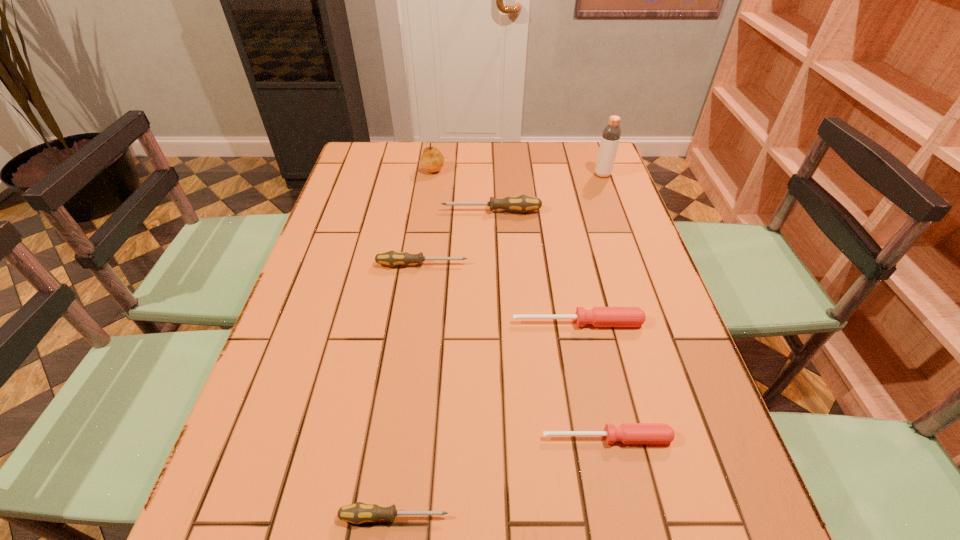
At what (x,y) coordinates should I click in order to perform the action: click on the second nearest screwdriver. Please return your answer as a coordinate pair (x, y). Looking at the image, I should click on (628, 433).

You are a GUI agent. You are given a task and a screenshot of the screen. Output one action in this format:
    pyautogui.click(x=<x>, y=<y>)
    Task: Click on the smallest gray screwdriver
    The width and height of the screenshot is (960, 540).
    Given the screenshot: What is the action you would take?
    pyautogui.click(x=357, y=513)

Locate an element on the screen. This screenshot has height=540, width=960. the nearest object is located at coordinates (357, 513).

I want to click on free space located on the left of the bottle, so click(x=507, y=174).

You are a GUI agent. You are given a task and a screenshot of the screen. Output one action in this format:
    pyautogui.click(x=<x>, y=<y>)
    Task: Click on the free space located on the front of the pear
    
    Given the screenshot: What is the action you would take?
    pyautogui.click(x=428, y=204)

Where is `blank space located at the tip of the farthest screwdriver`? blank space located at the tip of the farthest screwdriver is located at coordinates (338, 211).

Where is `free location located 0.110m at the tip of the farthest screwdriver`? The width and height of the screenshot is (960, 540). free location located 0.110m at the tip of the farthest screwdriver is located at coordinates (404, 211).

The image size is (960, 540). I want to click on vacant region located at the tip of the farthest screwdriver, so click(x=401, y=211).

Where is `free space located at the tip of the fourth nearest object`? The width and height of the screenshot is (960, 540). free space located at the tip of the fourth nearest object is located at coordinates (544, 265).

Where is `vacant space located 0.260m on the back of the third farthest screwdriver`? The image size is (960, 540). vacant space located 0.260m on the back of the third farthest screwdriver is located at coordinates (x=562, y=244).